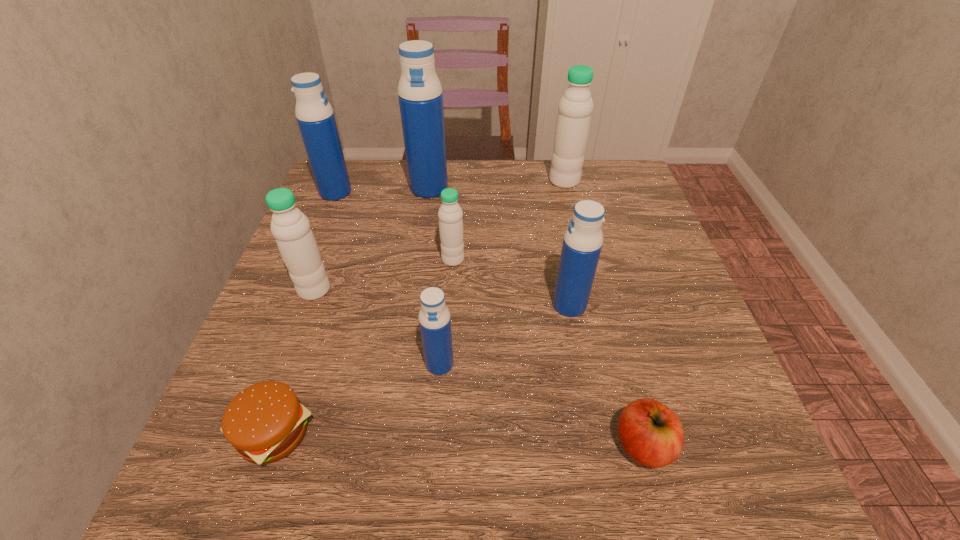
Find the location of `the smallest white water bottle`. the smallest white water bottle is located at coordinates (450, 214).

The height and width of the screenshot is (540, 960). What are the coordinates of `the nearest water bottle` in the screenshot? It's located at (434, 317).

This screenshot has width=960, height=540. What are the coordinates of `the smallest blue water bottle` in the screenshot? It's located at 434,317.

Identify the location of apple. This screenshot has height=540, width=960. (652, 434).

The image size is (960, 540). I want to click on hamburger, so pyautogui.click(x=265, y=422).

This screenshot has height=540, width=960. What are the coordinates of `vacant region located 0.380m on the front of the tallest water bottle` in the screenshot? It's located at (412, 310).

Where is `vacant space positioned 0.340m on the left of the farthest white water bottle`? vacant space positioned 0.340m on the left of the farthest white water bottle is located at coordinates (425, 181).

You are a GUI agent. You are given a task and a screenshot of the screen. Output one action in this format:
    pyautogui.click(x=<x>, y=<y>)
    Task: Click on the vacant space located on the right of the leftmost blue water bottle
    
    Given the screenshot: What is the action you would take?
    [x=465, y=192]

The width and height of the screenshot is (960, 540). Find the location of `vacant space located 0.050m on the right of the rightmost blue water bottle`. vacant space located 0.050m on the right of the rightmost blue water bottle is located at coordinates (612, 305).

What are the coordinates of `free space located on the right of the leftmost white water bottle` in the screenshot? It's located at (522, 290).